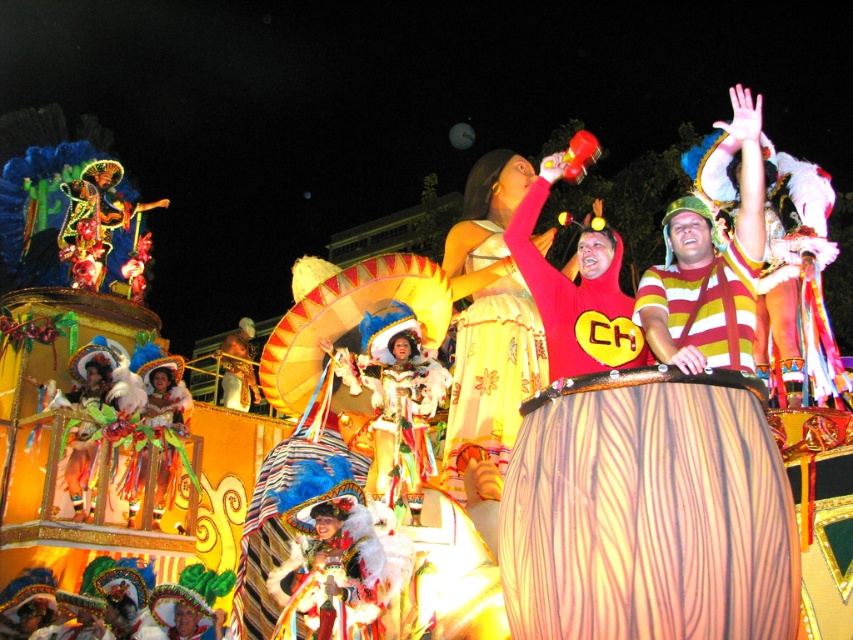
Question: Is shiny gold costume at center positioned in front of red velvet costume at center?

Choices:
 (A) no
 (B) yes

Answer: (B)

Question: Which object appears farthest from the camera in this image?

Choices:
 (A) shiny gold costume at center
 (B) shiny metallic costume at lower left
 (C) yellow fabric sombrero at center

Answer: (C)

Question: Considering the relative positions of yellow floral dress at center and yellow fabric sombrero at center in the image provided, where is yellow floral dress at center located with respect to yellow fabric sombrero at center?

Choices:
 (A) left
 (B) right

Answer: (B)

Question: Can you confirm if shiny metallic costume at lower left is positioned to the right of yellow fabric sombrero at center?

Choices:
 (A) no
 (B) yes

Answer: (B)

Question: Which object appears closest to the camera in this image?

Choices:
 (A) yellow fabric sombrero at center
 (B) yellow floral dress at center
 (C) shiny metallic costume at lower left

Answer: (B)

Question: Estimate the real-world distances between objects in this image. Which object is farther from the shiny gold costume at center?

Choices:
 (A) yellow floral dress at center
 (B) yellow striped shirt at upper right
 (C) yellow fabric sombrero at center

Answer: (C)